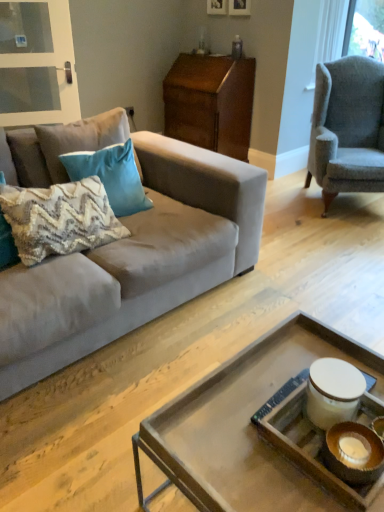
What do you see at coordinates (210, 102) in the screenshot?
I see `wooden nightstand at upper center` at bounding box center [210, 102].

What is the approximate height of wooden tray at center?

The height of wooden tray at center is 4.67 inches.

What do you see at coordinates (37, 64) in the screenshot? The image size is (384, 512). I see `clear glass screen door at upper left` at bounding box center [37, 64].

The width and height of the screenshot is (384, 512). Describe the element at coordinates (59, 219) in the screenshot. I see `textured beige pillow at left, marked as the 3th pillow in a back-to-front arrangement` at that location.

The height and width of the screenshot is (512, 384). In order to click on wooden picture frame at upper center, placed as the second picture frame when sorted from right to left in this screenshot , I will do `click(217, 7)`.

The height and width of the screenshot is (512, 384). In order to click on wooden nightstand at upper center in this screenshot , I will do `click(210, 102)`.

Considering the relative sizes of gray woolen armchair at right and wooden picture frame at upper center, placed as the second picture frame when sorted from right to left, in the image provided, is gray woolen armchair at right shorter than wooden picture frame at upper center, placed as the second picture frame when sorted from right to left,?

In fact, gray woolen armchair at right may be taller than wooden picture frame at upper center, placed as the second picture frame when sorted from right to left.

Are gray woolen armchair at right and wooden picture frame at upper center, placed as the second picture frame when sorted from right to left, located far from each other?

Yes, gray woolen armchair at right and wooden picture frame at upper center, placed as the second picture frame when sorted from right to left, are located far from each other.

Is gray woolen armchair at right facing towards wooden picture frame at upper center, placed as the second picture frame when sorted from right to left?

No, gray woolen armchair at right is not aimed at wooden picture frame at upper center, placed as the second picture frame when sorted from right to left.

Between gray woolen armchair at right and wooden picture frame at upper center, placed as the second picture frame when sorted from right to left, which one has smaller width?

Thinner between the two is wooden picture frame at upper center, placed as the second picture frame when sorted from right to left.

Between wooden picture frame at upper center, placed as the second picture frame when sorted from right to left, and matte brown tray at center, which one has less height?

Standing shorter between the two is wooden picture frame at upper center, placed as the second picture frame when sorted from right to left.

From a real-world perspective, does wooden picture frame at upper center, which appears as the 1th picture frame when viewed from the left, stand above matte brown tray at center?

Correct, in the physical world, wooden picture frame at upper center, which appears as the 1th picture frame when viewed from the left, is higher than matte brown tray at center.

How different are the orientations of wooden picture frame at upper center, placed as the second picture frame when sorted from right to left, and matte brown tray at center in degrees?

wooden picture frame at upper center, placed as the second picture frame when sorted from right to left, and matte brown tray at center are facing 93.4 degrees away from each other.

Considering the positions of objects wooden picture frame at upper center, placed as the second picture frame when sorted from right to left, and matte brown tray at center in the image provided, who is more to the left, wooden picture frame at upper center, placed as the second picture frame when sorted from right to left, or matte brown tray at center?

From the viewer's perspective, wooden picture frame at upper center, placed as the second picture frame when sorted from right to left, appears more on the left side.

In the scene shown: From the image's perspective, would you say textured cotton pillow at center, which is counted as the third pillow, starting from the front, is shown under textured beige pillow at left, which is the 1th pillow from front to back?

No, from the image's perspective, textured cotton pillow at center, which is counted as the third pillow, starting from the front, is not beneath textured beige pillow at left, which is the 1th pillow from front to back.

In the scene shown: Is textured cotton pillow at center, placed as the 1th pillow when sorted from back to front, further to camera compared to textured beige pillow at left, which is the 1th pillow from front to back?

Yes, textured cotton pillow at center, placed as the 1th pillow when sorted from back to front, is further from the viewer.

From a real-world perspective, starting from the textured cotton pillow at center, which is counted as the third pillow, starting from the front, which pillow is the 2nd one below it? Please provide its 2D coordinates.

[(59, 219)]

Considering the sizes of objects clear glass screen door at upper left and wooden picture frame at upper center, which appears as the 1th picture frame when viewed from the left, in the image provided, who is shorter, clear glass screen door at upper left or wooden picture frame at upper center, which appears as the 1th picture frame when viewed from the left,?

Standing shorter between the two is wooden picture frame at upper center, which appears as the 1th picture frame when viewed from the left.

Between clear glass screen door at upper left and wooden picture frame at upper center, which appears as the 1th picture frame when viewed from the left, which one has larger width?

Wider between the two is clear glass screen door at upper left.

From the image's perspective, is clear glass screen door at upper left located beneath wooden picture frame at upper center, placed as the second picture frame when sorted from right to left?

Yes.

Between point (24, 21) and point (209, 1), which one is positioned behind?

The point (209, 1) is farther.

From a real-world perspective, which object rests below the other?

In real-world perspective, matte brown tray at center is lower.

Would you say matte brown tray at center is a long distance from teal velvet pillow at upper left, placed as the second pillow when sorted from back to front?

matte brown tray at center is far away from teal velvet pillow at upper left, placed as the second pillow when sorted from back to front.

Locate an element on the screen. coffee table below the teal velvet pillow at upper left, which ranks as the 2th pillow in front-to-back order (from the image's perspective) is located at coordinates (256, 429).

Which object is wider, wooden nightstand at upper center or wooden picture frame at upper center, which is the 2th picture frame in left-to-right order?

Wider between the two is wooden nightstand at upper center.

Considering the positions of objects wooden nightstand at upper center and wooden picture frame at upper center, marked as the first picture frame in a right-to-left arrangement, in the image provided, who is more to the right, wooden nightstand at upper center or wooden picture frame at upper center, marked as the first picture frame in a right-to-left arrangement,?

wooden picture frame at upper center, marked as the first picture frame in a right-to-left arrangement.

From the image's perspective, which one is positioned higher, wooden nightstand at upper center or wooden picture frame at upper center, which is the 2th picture frame in left-to-right order?

wooden picture frame at upper center, which is the 2th picture frame in left-to-right order.

Is suede couch at left positioned beyond the bounds of gray woolen armchair at right?

Indeed, suede couch at left is completely outside gray woolen armchair at right.

Is suede couch at left positioned before gray woolen armchair at right?

Yes, suede couch at left is closer to the camera.

How far apart are suede couch at left and gray woolen armchair at right?

suede couch at left and gray woolen armchair at right are 5.14 feet apart from each other.

At what (x,y) coordinates should I click in order to perform the action: click on the 1st picture frame positioned above the gray woolen armchair at right (from a real-world perspective). Please return your answer as a coordinate pair (x, y). The height and width of the screenshot is (512, 384). Looking at the image, I should click on (217, 7).

Where is `picture frame that appears on the left of matte brown tray at center`? This screenshot has width=384, height=512. picture frame that appears on the left of matte brown tray at center is located at coordinates (217, 7).

Considering their positions, is wooden nightstand at upper center positioned further to teal velvet pillow at upper left, which ranks as the 2th pillow in front-to-back order, than matte brown tray at center?

wooden nightstand at upper center is positioned further to the anchor teal velvet pillow at upper left, which ranks as the 2th pillow in front-to-back order.

Estimate the real-world distances between objects in this image. Which object is further from wooden tray at center, suede couch at left or wooden picture frame at upper center, which is the 2th picture frame in left-to-right order?

wooden picture frame at upper center, which is the 2th picture frame in left-to-right order.

From the picture: Which object lies nearer to the anchor point gray woolen armchair at right, wooden tray at center or wooden picture frame at upper center, which is the 2th picture frame in left-to-right order?

wooden picture frame at upper center, which is the 2th picture frame in left-to-right order.

Based on their spatial positions, is clear glass screen door at upper left or textured beige pillow at left, which is the 1th pillow from front to back, further from gray woolen armchair at right?

clear glass screen door at upper left lies further to gray woolen armchair at right than the other object.

Considering their positions, is teal velvet pillow at upper left, which ranks as the 2th pillow in front-to-back order, positioned closer to gray woolen armchair at right than textured beige pillow at left, which is the 1th pillow from front to back?

teal velvet pillow at upper left, which ranks as the 2th pillow in front-to-back order, lies closer to gray woolen armchair at right than the other object.

From the image, which object appears to be farther from matte brown tray at center, wooden picture frame at upper center, placed as the second picture frame when sorted from right to left, or wooden tray at center?

wooden picture frame at upper center, placed as the second picture frame when sorted from right to left, is further to matte brown tray at center.

Based on their spatial positions, is suede couch at left or textured cotton pillow at center, placed as the 1th pillow when sorted from back to front, closer to textured beige pillow at left, which is the 1th pillow from front to back?

suede couch at left lies closer to textured beige pillow at left, which is the 1th pillow from front to back, than the other object.

When comparing their distances from gray woolen armchair at right, does wooden nightstand at upper center or suede couch at left seem further?

Based on the image, suede couch at left appears to be further to gray woolen armchair at right.

Find the location of a particular element. nightstand between textured beige pillow at left, which is the 1th pillow from front to back, and wooden picture frame at upper center, which appears as the 1th picture frame when viewed from the left, in the front-back direction is located at coordinates (210, 102).

Identify the location of screen door between wooden picture frame at upper center, which is the 2th picture frame in left-to-right order, and teal velvet pillow at upper left, which ranks as the 2th pillow in front-to-back order, vertically. (37, 64).

Find the location of a particular element. This screenshot has width=384, height=512. nightstand between wooden picture frame at upper center, which is the 2th picture frame in left-to-right order, and teal velvet pillow at upper left, which ranks as the 2th pillow in front-to-back order, vertically is located at coordinates (210, 102).

You are a GUI agent. You are given a task and a screenshot of the screen. Output one action in this format:
    pyautogui.click(x=<x>, y=<y>)
    Task: Click on the chair located between suede couch at left and wooden picture frame at upper center, which is the 2th picture frame in left-to-right order, in the depth direction
    Image resolution: width=384 pixels, height=512 pixels.
    Given the screenshot: What is the action you would take?
    pyautogui.click(x=347, y=128)